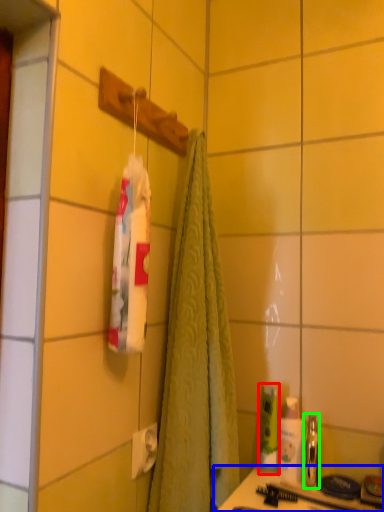
Question: Which is nearer to the mouthwash (highlighted by a red box)? counter (highlighted by a blue box) or mouthwash (highlighted by a green box).

Choices:
 (A) counter
 (B) mouthwash

Answer: (B)